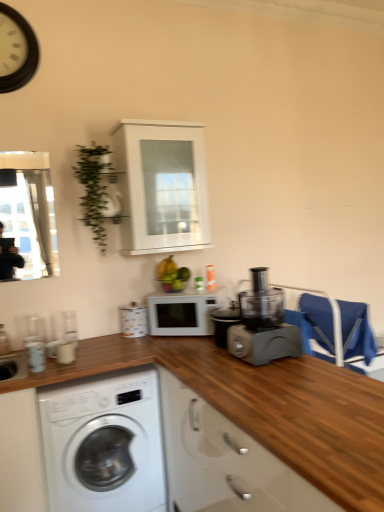
Question: Is point click(x=352, y=305) positioned closer to the camera than point click(x=71, y=389)?

Choices:
 (A) closer
 (B) farther

Answer: (B)

Question: Based on their sizes in the image, would you say blue fabric chair at right is bigger or smaller than white glossy washing machine at lower left?

Choices:
 (A) big
 (B) small

Answer: (B)

Question: Which is nearer to the white matte microwave at center?

Choices:
 (A) white glossy cabinet at upper center
 (B) white wooden clock at upper left
 (C) green leafy plant at upper left
 (D) white glossy cup at lower left, which is the first appliance from front to back
 (E) matte plastic food processor at center-right

Answer: (E)

Question: Based on their relative distances, which object is nearer to the wooden at lower center?

Choices:
 (A) blue fabric chair at right
 (B) white matte microwave at center
 (C) green leafy plant at upper left
 (D) matte plastic food processor at center-right
 (E) white glossy cup at lower left, positioned as the first appliance in left-to-right order

Answer: (D)